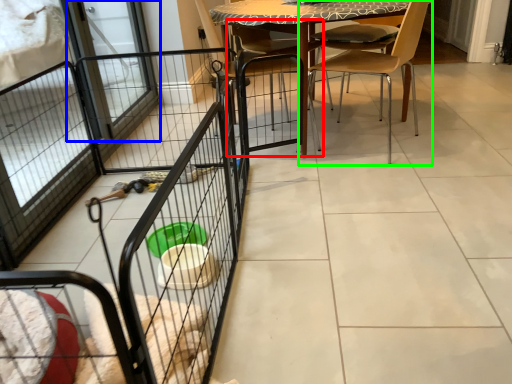
Question: Estimate the real-world distances between objects in this image. Which object is farther from armchair (highlighted by a red box), screen door (highlighted by a blue box) or chair (highlighted by a green box)?

Choices:
 (A) screen door
 (B) chair

Answer: (A)